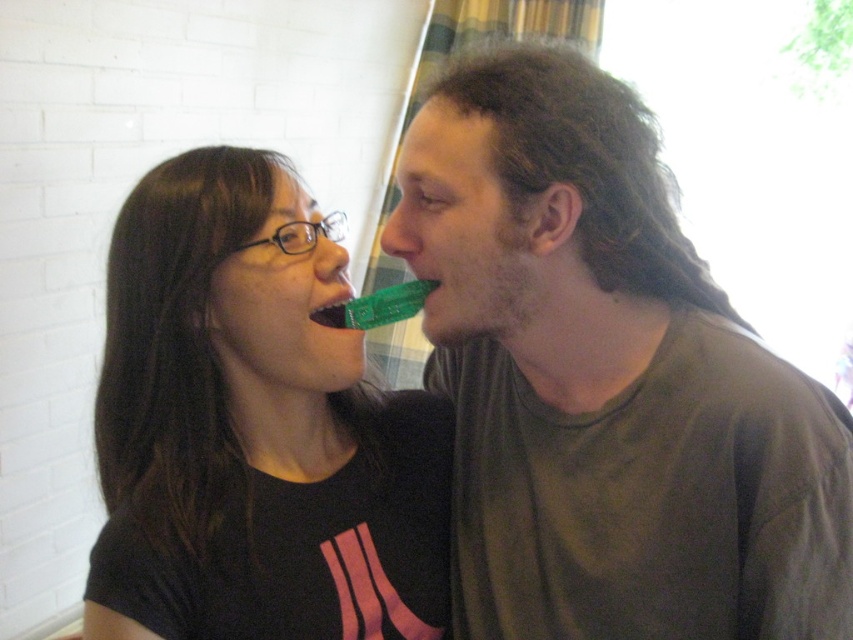
Is green plastic toothbrush at upper right to the right of matte black t-shirt at center from the viewer's perspective?

Correct, you'll find green plastic toothbrush at upper right to the right of matte black t-shirt at center.

Does green plastic toothbrush at upper right have a greater height compared to matte black t-shirt at center?

Correct, green plastic toothbrush at upper right is much taller as matte black t-shirt at center.

Is point (651, 448) more distant than point (352, 588)?

No, (651, 448) is closer to viewer.

This screenshot has width=853, height=640. I want to click on green plastic toothbrush at upper right, so click(x=606, y=381).